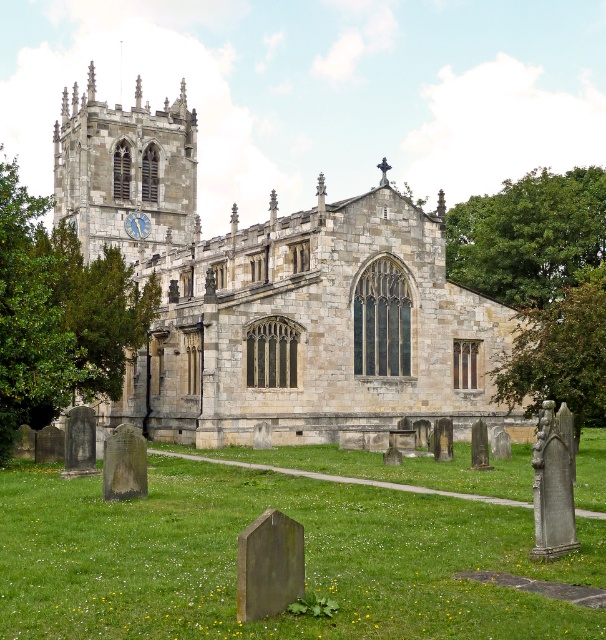
In the scene shown: You are standing in front of the historic stone church and want to walk towards the green leafy tree at center. Which direction should you walk to avoid passing by the green leafy tree at left?

To reach the green leafy tree at center without passing by the green leafy tree at left, you should walk to the right side, as the green leafy tree at left is positioned to the left of the green leafy tree at center.

You are standing in front of the historic stone church and notice two green leafy trees. Which tree, the green leafy tree at left or the green leafy tree at center, is positioned higher up in the image?

The green leafy tree at left is positioned higher up in the image than the green leafy tree at center.